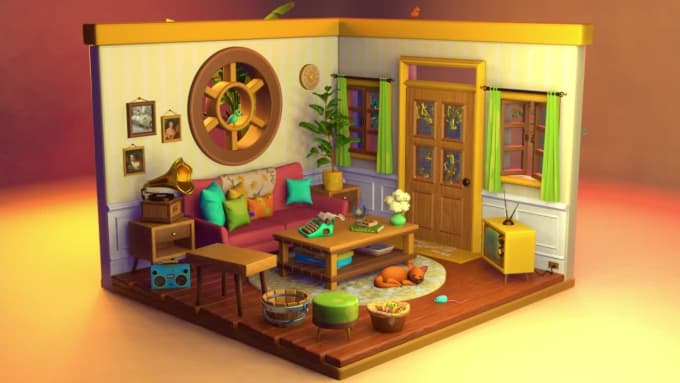
You are a GUI agent. You are given a task and a screenshot of the screen. Output one action in this format:
    pyautogui.click(x=<x>, y=<y>)
    Task: Click on the brown wall
    
    Given the screenshot: What is the action you would take?
    pyautogui.click(x=636, y=115)